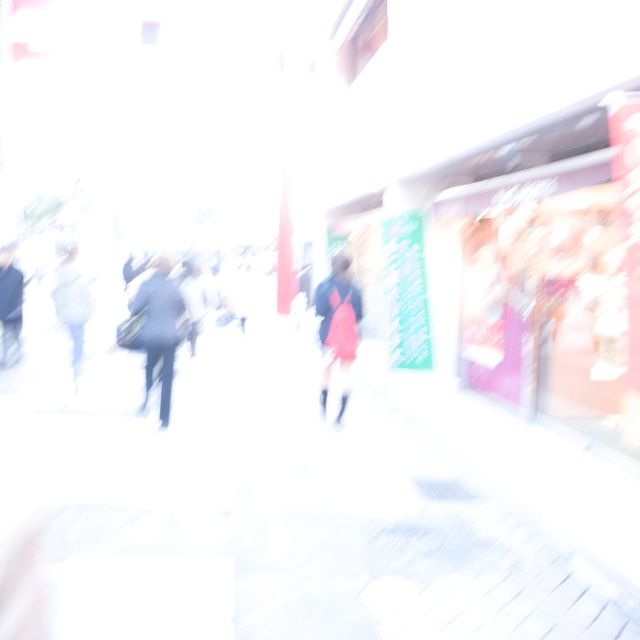
Question: Can you confirm if white concrete pavement at center is positioned to the right of dark gray suit at left?

Choices:
 (A) no
 (B) yes

Answer: (B)

Question: Which point appears farthest from the camera in this image?

Choices:
 (A) (1, 292)
 (B) (332, 317)
 (C) (52, 294)
 (D) (150, 612)

Answer: (A)

Question: Does white concrete pavement at center lie behind white fabric coat at left?

Choices:
 (A) yes
 (B) no

Answer: (B)

Question: Can you confirm if red fabric coat at center is positioned above white fabric coat at left?

Choices:
 (A) yes
 (B) no

Answer: (B)

Question: Among these objects, which one is farthest from the camera?

Choices:
 (A) white fabric coat at left
 (B) red fabric coat at center
 (C) dark blue suit at center
 (D) white concrete pavement at center

Answer: (A)

Question: Which of these objects is positioned farthest from the red fabric coat at center?

Choices:
 (A) white fabric coat at left
 (B) dark blue suit at center

Answer: (A)